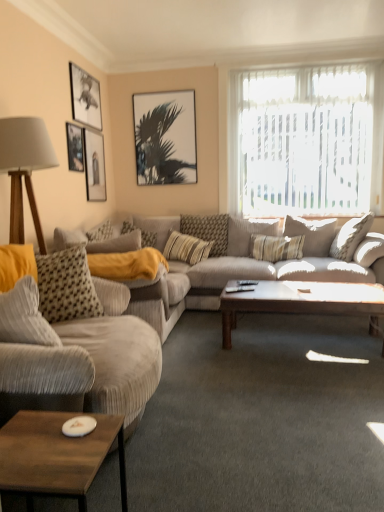
At what (x,y) coordinates should I click in order to perform the action: click on vacant point above wooden rectangular table at lower left, which is the first coffee table from front to back (from a real-world perspective). Please return your answer as a coordinate pair (x, y). The image size is (384, 512). Looking at the image, I should click on (66, 438).